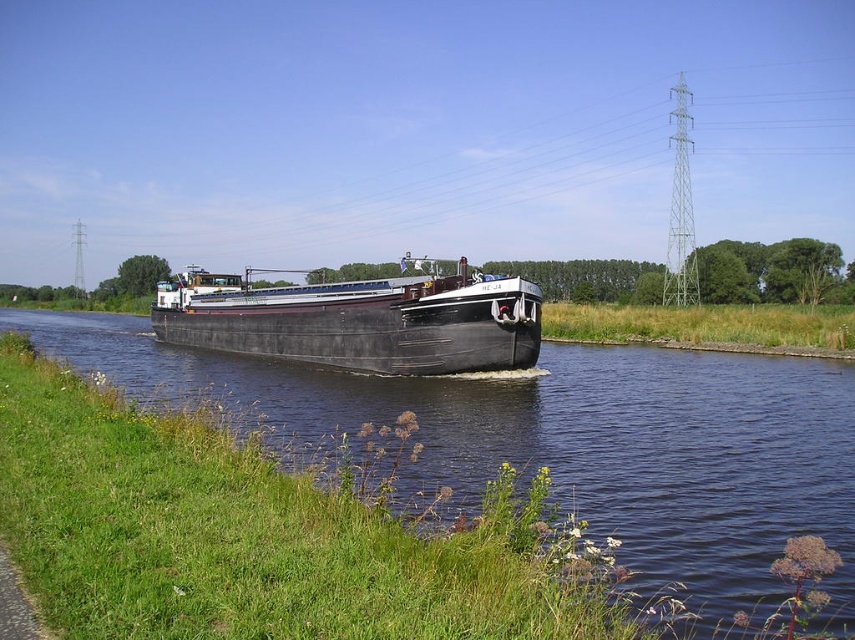
Can you confirm if black rubber boat at center is positioned to the left of matte black barge at center?

No, black rubber boat at center is not to the left of matte black barge at center.

Is black rubber boat at center taller than matte black barge at center?

No, black rubber boat at center is not taller than matte black barge at center.

Describe the element at coordinates (563, 440) in the screenshot. I see `black rubber boat at center` at that location.

Find the location of a particular element. This screenshot has width=855, height=640. black rubber boat at center is located at coordinates (563, 440).